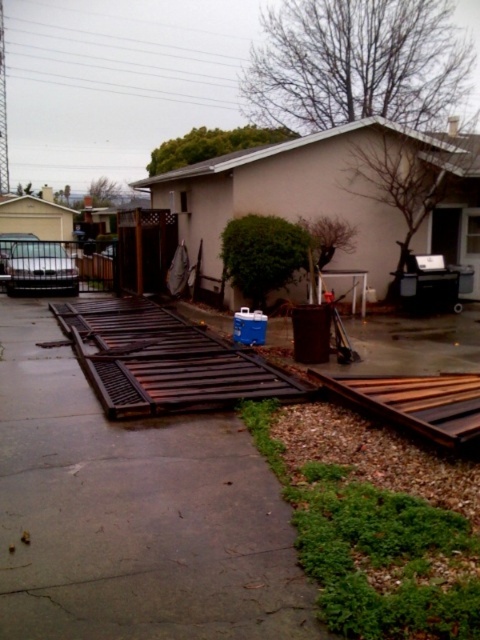
Question: Which object is closer to the camera taking this photo?

Choices:
 (A) brown metal train track at center
 (B) brown wooden planks at center

Answer: (A)

Question: Is brown wooden planks at center below brown metal train track at center?

Choices:
 (A) yes
 (B) no

Answer: (B)

Question: Is brown wooden planks at center wider than brown metal train track at center?

Choices:
 (A) no
 (B) yes

Answer: (B)

Question: Which object appears closest to the camera in this image?

Choices:
 (A) brown wooden planks at center
 (B) brown metal train track at center

Answer: (B)

Question: Is brown wooden planks at center behind brown metal train track at center?

Choices:
 (A) no
 (B) yes

Answer: (B)

Question: Which point is farther to the camera?

Choices:
 (A) brown wooden planks at center
 (B) brown metal train track at center

Answer: (A)